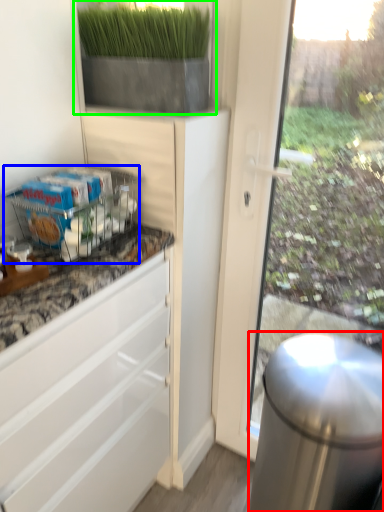
Question: Which object is positioned closest to appliance (highlighted by a red box)? Select from shelf (highlighted by a blue box) and houseplant (highlighted by a green box).

Choices:
 (A) shelf
 (B) houseplant

Answer: (A)